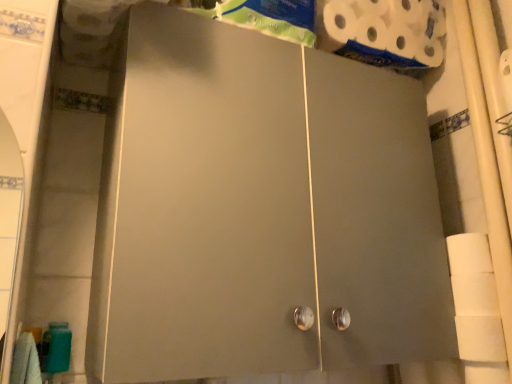
Question: From a real-world perspective, is white matte toilet paper at right, which appears as the 2th toilet paper when viewed from the back, on matte gray cabinet at center?

Choices:
 (A) no
 (B) yes

Answer: (A)

Question: Is white matte toilet paper at right, which appears as the 2th toilet paper when viewed from the back, closer to the viewer compared to matte gray cabinet at center?

Choices:
 (A) no
 (B) yes

Answer: (A)

Question: Is matte gray cabinet at center completely or partially inside white matte toilet paper at right, arranged as the second toilet paper when viewed from the top?

Choices:
 (A) yes
 (B) no

Answer: (B)

Question: Considering the relative sizes of white matte toilet paper at right, arranged as the second toilet paper when viewed from the top, and matte gray cabinet at center in the image provided, is white matte toilet paper at right, arranged as the second toilet paper when viewed from the top, shorter than matte gray cabinet at center?

Choices:
 (A) no
 (B) yes

Answer: (B)

Question: Does white matte toilet paper at right, acting as the first toilet paper starting from the front, come behind matte gray cabinet at center?

Choices:
 (A) yes
 (B) no

Answer: (A)

Question: From a real-world perspective, relative to white matte toilet paper at right, which appears as the 2th toilet paper when viewed from the back, is white matte toilet paper at upper right, acting as the first toilet paper starting from the back, vertically above or below?

Choices:
 (A) above
 (B) below

Answer: (A)

Question: Considering the relative positions of white matte toilet paper at upper right, acting as the first toilet paper starting from the back, and white matte toilet paper at right, positioned as the 1th toilet paper in bottom-to-top order, in the image provided, is white matte toilet paper at upper right, acting as the first toilet paper starting from the back, to the left or to the right of white matte toilet paper at right, positioned as the 1th toilet paper in bottom-to-top order,?

Choices:
 (A) left
 (B) right

Answer: (A)

Question: Is white matte toilet paper at upper right, acting as the first toilet paper starting from the back, inside or outside of white matte toilet paper at right, positioned as the 1th toilet paper in bottom-to-top order?

Choices:
 (A) inside
 (B) outside

Answer: (B)

Question: Considering the positions of white matte toilet paper at upper right, acting as the first toilet paper starting from the back, and white matte toilet paper at right, acting as the first toilet paper starting from the front, in the image, is white matte toilet paper at upper right, acting as the first toilet paper starting from the back, taller or shorter than white matte toilet paper at right, acting as the first toilet paper starting from the front,?

Choices:
 (A) tall
 (B) short

Answer: (B)

Question: Is matte gray cabinet at center taller or shorter than white matte toilet paper at right, positioned as the 1th toilet paper in bottom-to-top order?

Choices:
 (A) tall
 (B) short

Answer: (A)

Question: Do you think matte gray cabinet at center is within white matte toilet paper at right, arranged as the second toilet paper when viewed from the top, or outside of it?

Choices:
 (A) inside
 (B) outside

Answer: (B)

Question: From the image's perspective, is matte gray cabinet at center located above or below white matte toilet paper at right, acting as the first toilet paper starting from the front?

Choices:
 (A) above
 (B) below

Answer: (A)

Question: In the image, is matte gray cabinet at center positioned in front of or behind white matte toilet paper at right, acting as the first toilet paper starting from the front?

Choices:
 (A) behind
 (B) front

Answer: (B)

Question: In terms of width, does white matte toilet paper at right, acting as the first toilet paper starting from the front, look wider or thinner when compared to white matte toilet paper at upper right, marked as the second toilet paper in a bottom-to-top arrangement?

Choices:
 (A) thin
 (B) wide

Answer: (A)

Question: Based on their sizes in the image, would you say white matte toilet paper at right, positioned as the 1th toilet paper in bottom-to-top order, is bigger or smaller than white matte toilet paper at upper right, the 1th toilet paper positioned from the top?

Choices:
 (A) small
 (B) big

Answer: (A)